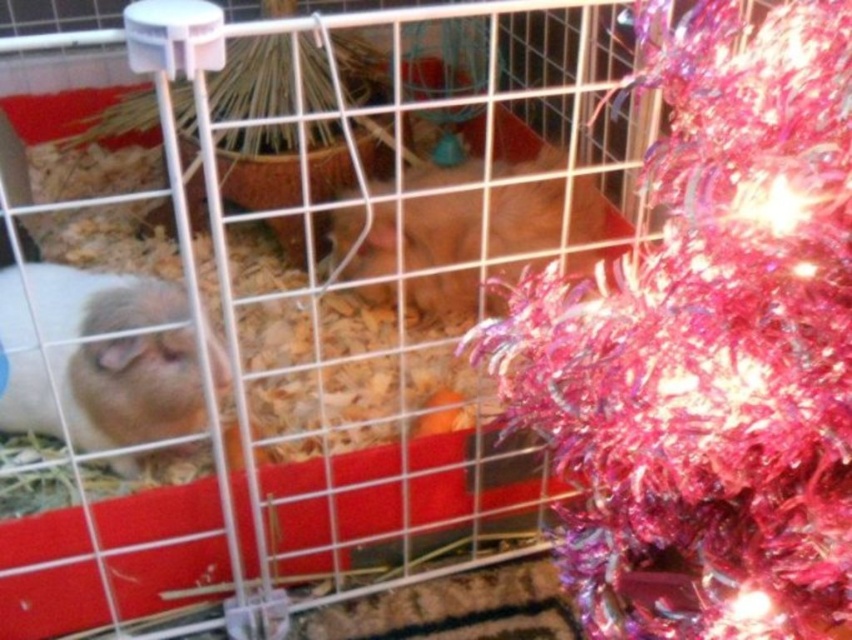
Question: Can you confirm if fuzzy beige hamster at left is positioned below fuzzy brown hamster at center?

Choices:
 (A) yes
 (B) no

Answer: (A)

Question: Is fuzzy beige hamster at left further to the viewer compared to fuzzy brown hamster at center?

Choices:
 (A) no
 (B) yes

Answer: (A)

Question: Which point is farther to the camera?

Choices:
 (A) fuzzy beige hamster at left
 (B) shiny pink tinsel at center

Answer: (A)

Question: Which of the following is the closest to the observer?

Choices:
 (A) (4, 428)
 (B) (540, 161)
 (C) (694, 358)

Answer: (C)

Question: Which object appears closest to the camera in this image?

Choices:
 (A) shiny pink tinsel at center
 (B) fuzzy brown hamster at center

Answer: (A)

Question: Is the position of shiny pink tinsel at center more distant than that of fuzzy brown hamster at center?

Choices:
 (A) yes
 (B) no

Answer: (B)